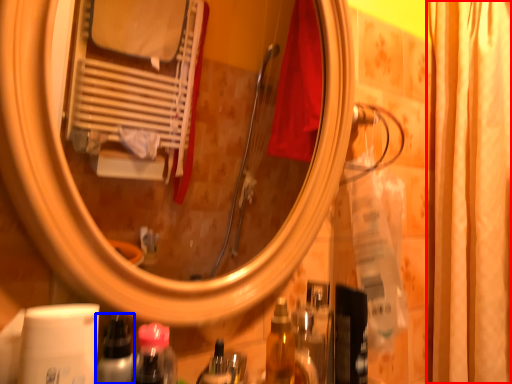
Question: Which of the following is the closest to the observer, shower curtain (highlighted by a red box) or bottle (highlighted by a blue box)?

Choices:
 (A) shower curtain
 (B) bottle

Answer: (B)